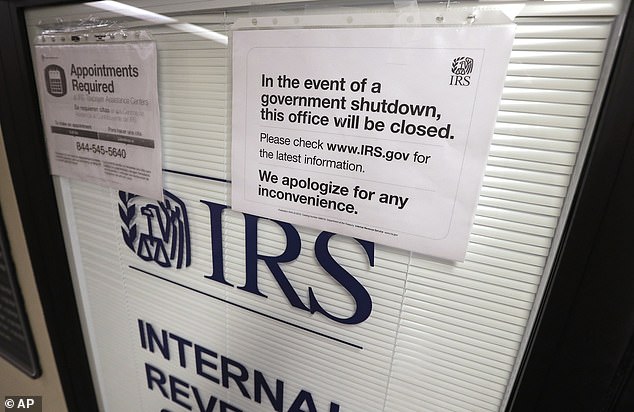
In order to click on white blinds in this screenshot , I will do `click(463, 363)`.